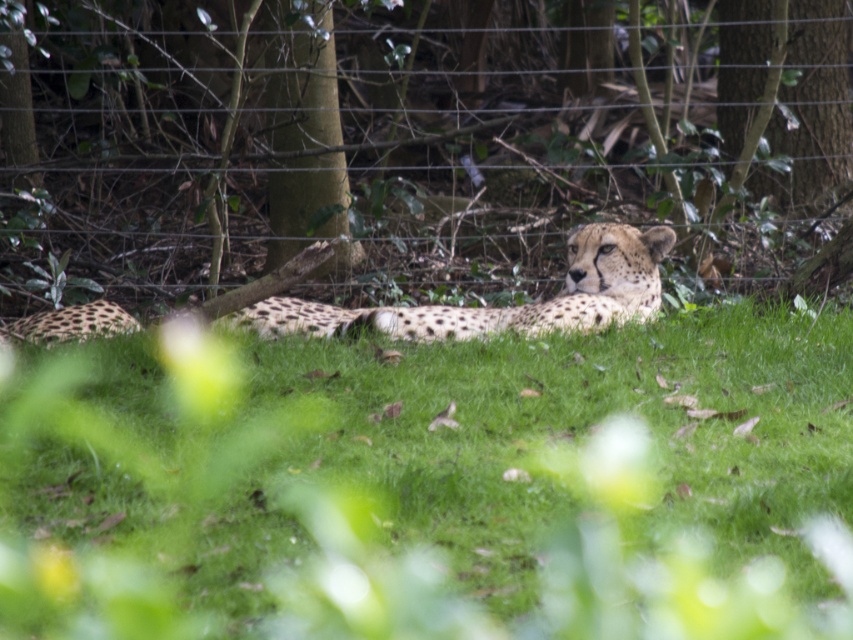
You are a zookeeper trying to feed the spotted fur cheetah at center. You have a food tray that you want to place on the wire mesh at center. From the cheetahs perspective, should you place the tray to its left or right side?

The wire mesh at center is to the right of the spotted fur cheetah at center, so you should place the tray to the right side from the cheetahs perspective.